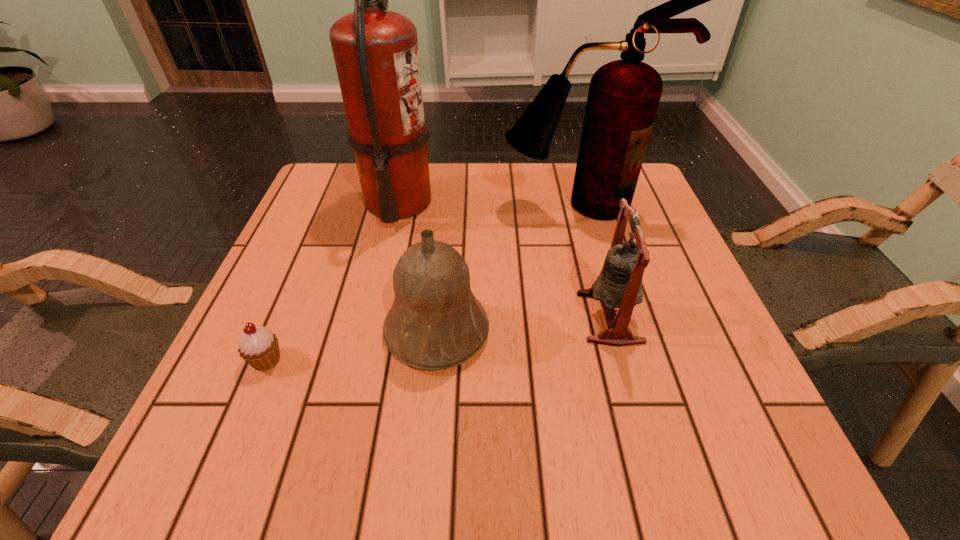
Where is `vacant region located on the front of the cupcake`? Image resolution: width=960 pixels, height=540 pixels. vacant region located on the front of the cupcake is located at coordinates (225, 460).

Locate an element on the screen. This screenshot has height=540, width=960. fire extinguisher at the left edge is located at coordinates pyautogui.click(x=376, y=54).

Where is `cupcake present at the left edge`? Image resolution: width=960 pixels, height=540 pixels. cupcake present at the left edge is located at coordinates (258, 346).

The width and height of the screenshot is (960, 540). Find the location of `fire extinguisher at the right edge`. fire extinguisher at the right edge is located at coordinates (623, 97).

At what (x,y) coordinates should I click in order to perform the action: click on bell at the right edge. Please return your answer as a coordinate pair (x, y). Image resolution: width=960 pixels, height=540 pixels. Looking at the image, I should click on (619, 285).

Locate an element on the screen. The width and height of the screenshot is (960, 540). object located in the far left corner section of the desktop is located at coordinates 376,54.

This screenshot has height=540, width=960. Identify the location of object that is positioned at the far right corner. (623, 97).

At what (x,y) coordinates should I click in order to perform the action: click on vacant space at the far edge. Please return your answer as a coordinate pair (x, y). The image size is (960, 540). Looking at the image, I should click on [564, 210].

The image size is (960, 540). Find the location of `vacant area at the near edge`. vacant area at the near edge is located at coordinates (603, 468).

Where is `vacant space at the left edge`? This screenshot has width=960, height=540. vacant space at the left edge is located at coordinates (284, 381).